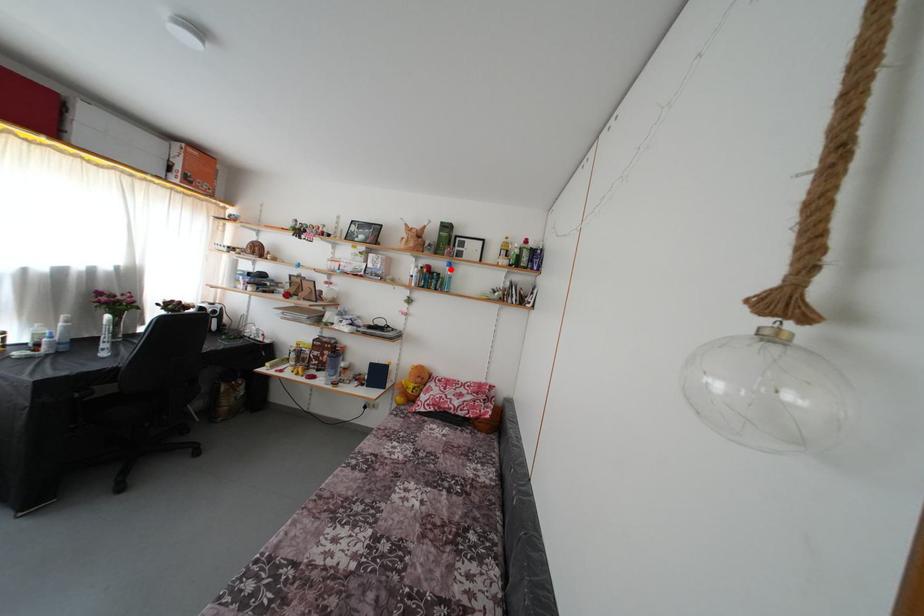
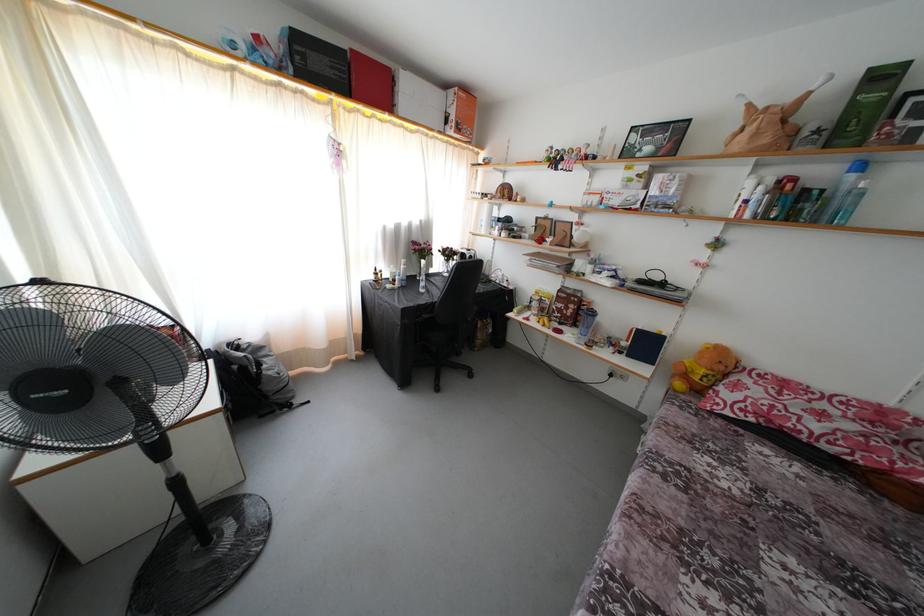
Question: I am providing you with two images of the same scene from different viewpoints. Given a red point in image1, look at the same physical point in image2. Is it:

Choices:
 (A) Closer to the viewpoint
 (B) Farther from the viewpoint

Answer: (B)